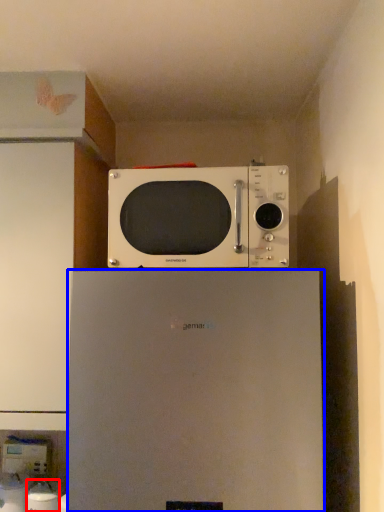
Question: Which point is further to the camera, appliance (highlighted by a red box) or refrigerator (highlighted by a blue box)?

Choices:
 (A) appliance
 (B) refrigerator

Answer: (A)